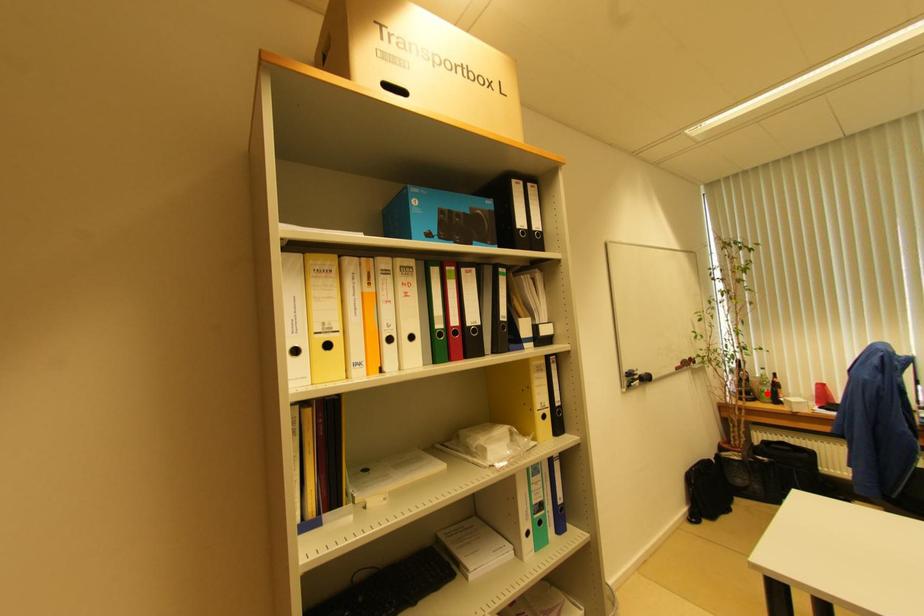
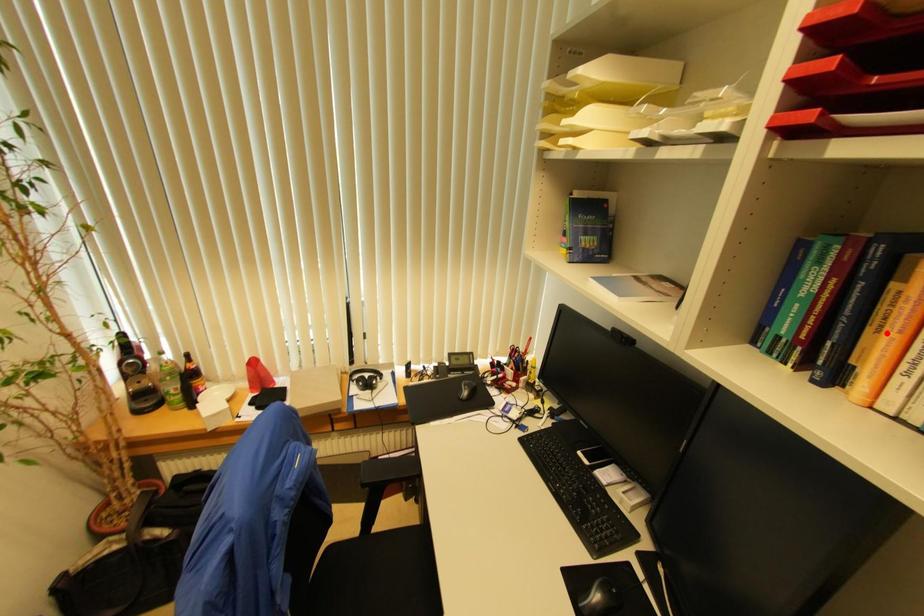
Looking at this image, I am providing you with two images of the same scene from different viewpoints. A red point is marked on the first image and another point is marked on the second image. Is the marked point in image1 the same physical position as the marked point in image2?

No